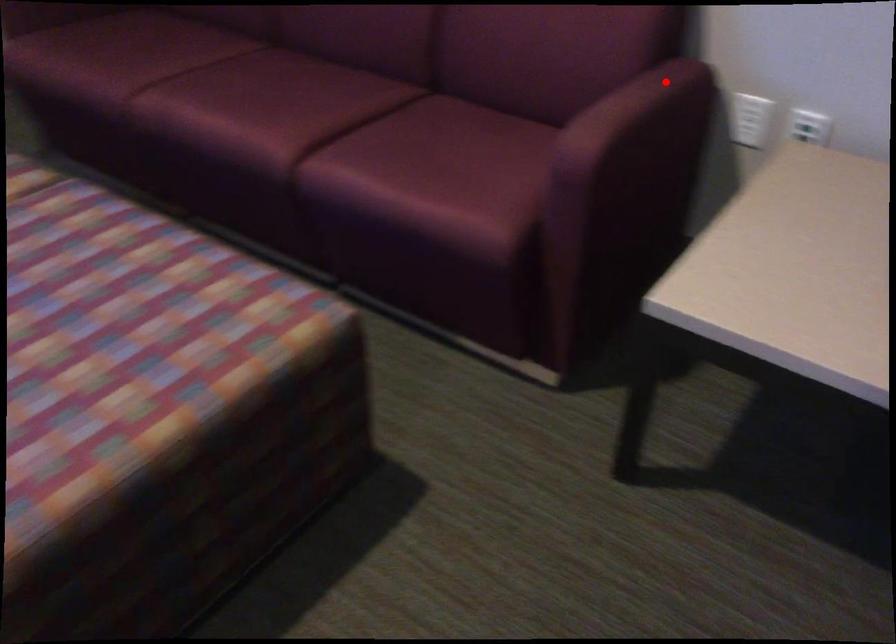
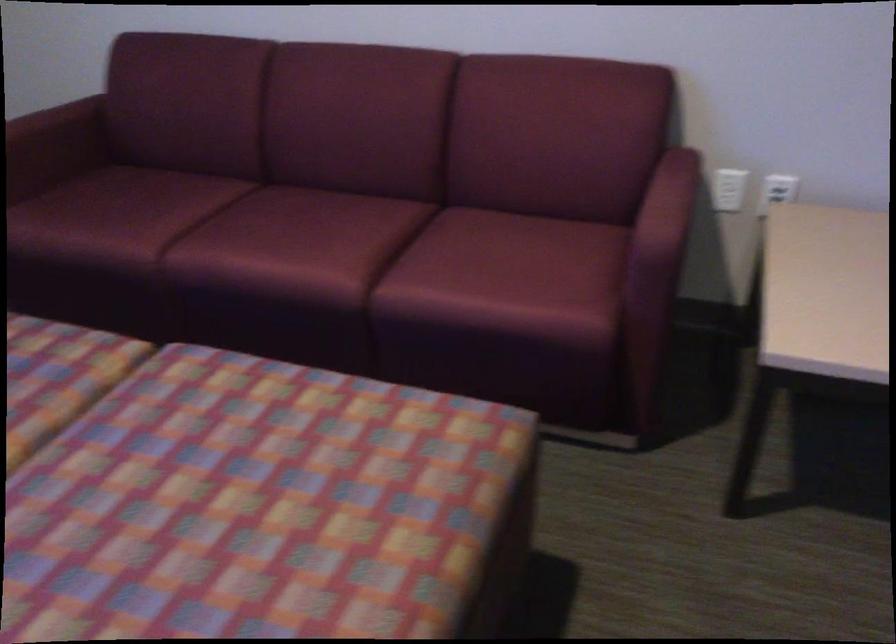
Find the pixel in the second image that matches the highlighted location in the first image.

(678, 166)